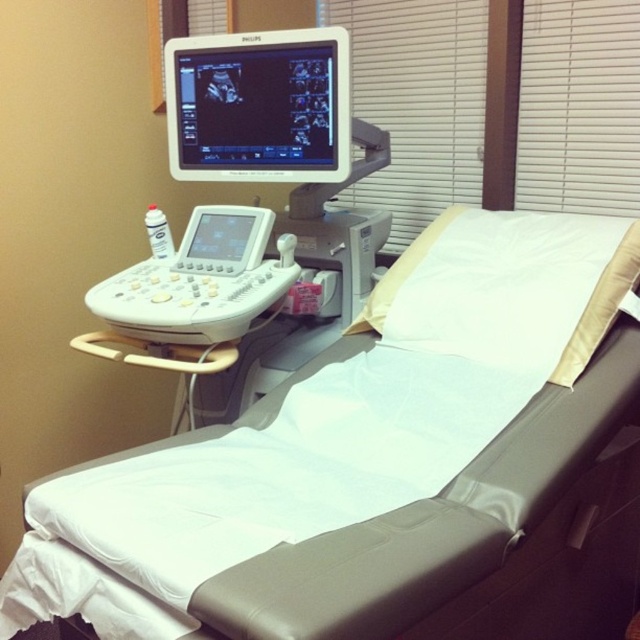
Which is behind, point (493, 436) or point (428, 92)?

The point (428, 92) is behind.

This screenshot has width=640, height=640. Identify the location of white vinyl bed at center. (356, 454).

Between white plastic blinds at upper center and white plastic ultrasound machine at left, which one is positioned lower?

white plastic ultrasound machine at left

Between point (371, 188) and point (204, 214), which one is positioned behind?

Positioned behind is point (371, 188).

Locate an element on the screen. The height and width of the screenshot is (640, 640). white plastic blinds at upper center is located at coordinates (417, 100).

Does white plastic blinds at upper center have a greater height compared to white glossy monitor at upper center?

Yes, white plastic blinds at upper center is taller than white glossy monitor at upper center.

Is point (602, 160) less distant than point (333, 32)?

No, it is not.

In order to click on white plastic blinds at upper center in this screenshot , I will do `click(417, 100)`.

Find the location of a particular element. This screenshot has width=640, height=640. white plastic blinds at upper center is located at coordinates (417, 100).